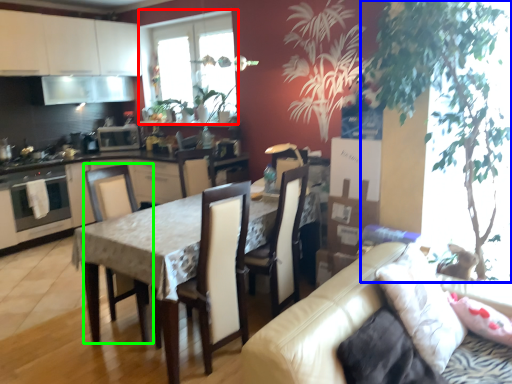
Question: Estimate the real-world distances between objects in this image. Which object is farther from window (highlighted by a red box), plant (highlighted by a blue box) or chair (highlighted by a green box)?

Choices:
 (A) plant
 (B) chair

Answer: (A)